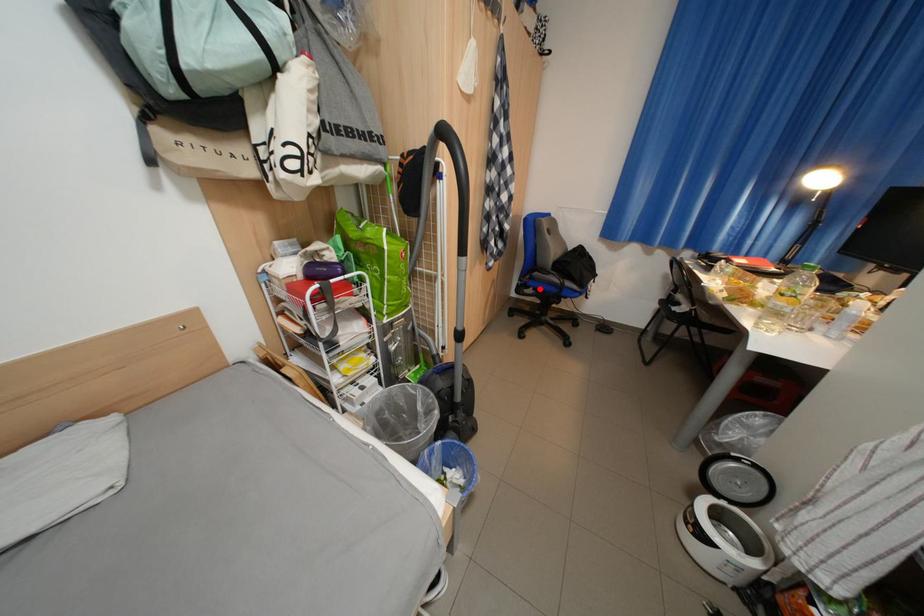
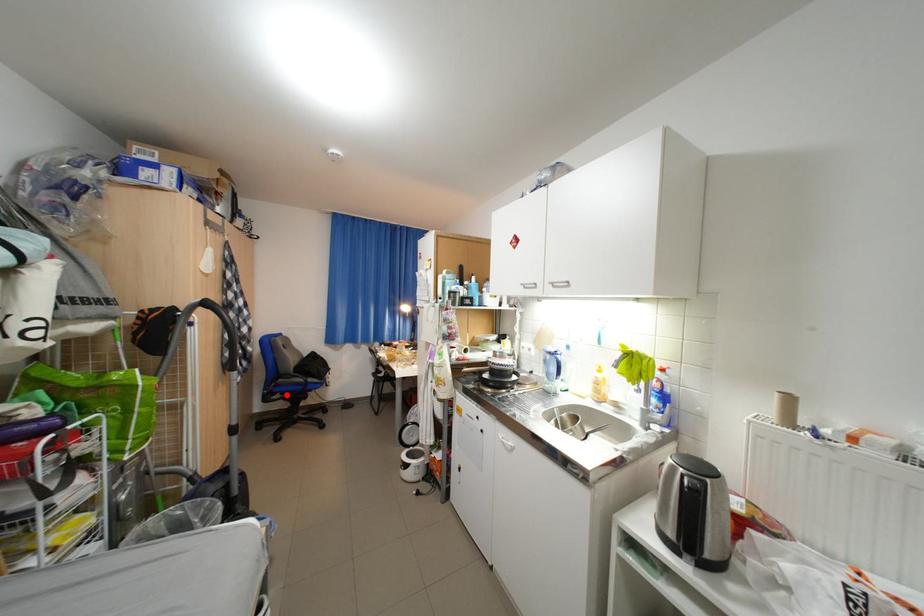
I am providing you with two images of the same scene from different viewpoints. A red point is marked on the first image and another point is marked on the second image. Is the red point in image1 aligned with the point shown in image2?

Yes